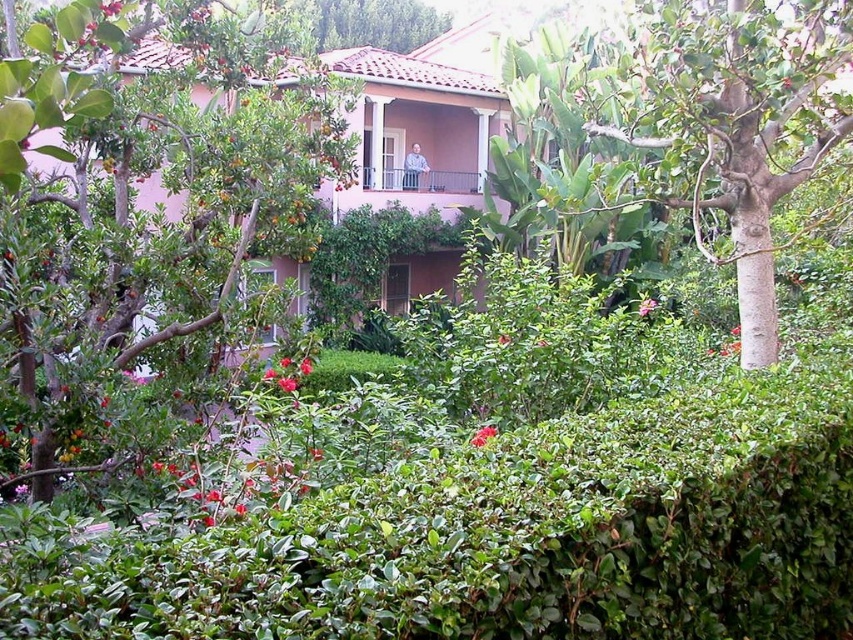
You are a gardener who wants to plant a new bush that needs at least 2 meters of space between it and the nearest tall object. Given the green leafy tree at center and the smooth pink flower at center, which object should you consider for spacing requirements?

The green leafy tree at center is taller than the smooth pink flower at center, so you should consider the green leafy tree at center for spacing requirements as it is the taller object and may require more space.

You are standing in the garden and want to take a photo of the green leafy bush at center. Based on its position, where should you stand relative to the hedge to ensure it is fully visible in your shot?

The green leafy bush at center is located at point (482, 435), so you should position yourself behind the hedge to capture it in your photo since it is positioned near the midsection of the garden between the hedge and the building.

You are standing in the garden and want to take a photo of the two points mentioned. Which point, point (109, 12) or point (306, 356), will appear larger in your camera view?

Point (109, 12) will appear larger in the camera view because it is closer to the camera than point (306, 356).